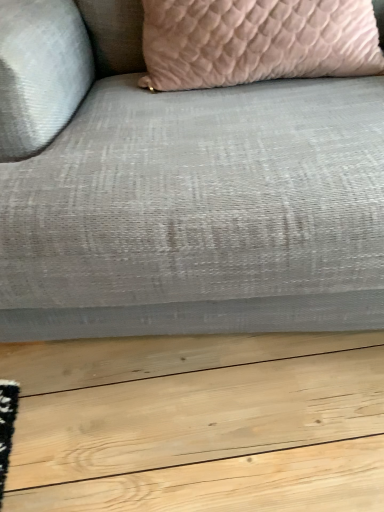
In order to face pink textured pillow at upper center, should I rotate leftwards or rightwards?

Rotate your view right by about 8.727°.

Describe the element at coordinates (256, 41) in the screenshot. This screenshot has height=512, width=384. I see `pink textured pillow at upper center` at that location.

You are a GUI agent. You are given a task and a screenshot of the screen. Output one action in this format:
    pyautogui.click(x=<x>, y=<y>)
    Task: Click on the pink textured pillow at upper center
    Image resolution: width=384 pixels, height=512 pixels.
    Given the screenshot: What is the action you would take?
    point(256,41)

Locate an element on the screen. The height and width of the screenshot is (512, 384). textured gray fabric couch at center is located at coordinates (199, 213).

Image resolution: width=384 pixels, height=512 pixels. What do you see at coordinates (199, 213) in the screenshot? I see `textured gray fabric couch at center` at bounding box center [199, 213].

Locate an element on the screen. Image resolution: width=384 pixels, height=512 pixels. pink textured pillow at upper center is located at coordinates (256, 41).

Between textured gray fabric couch at center and pink textured pillow at upper center, which one appears on the right side from the viewer's perspective?

From the viewer's perspective, pink textured pillow at upper center appears more on the right side.

Which object is further away from the camera, textured gray fabric couch at center or pink textured pillow at upper center?

pink textured pillow at upper center is more distant.

Does point (379, 271) lie in front of point (212, 64)?

That is True.

From the image's perspective, is textured gray fabric couch at center on top of pink textured pillow at upper center?

No.

From a real-world perspective, relative to pink textured pillow at upper center, is textured gray fabric couch at center vertically above or below?

Clearly, from a real-world perspective, textured gray fabric couch at center is below pink textured pillow at upper center.

Is textured gray fabric couch at center wider or thinner than pink textured pillow at upper center?

Considering their sizes, textured gray fabric couch at center looks broader than pink textured pillow at upper center.

In terms of height, does textured gray fabric couch at center look taller or shorter compared to pink textured pillow at upper center?

In the image, textured gray fabric couch at center appears to be taller than pink textured pillow at upper center.

Does textured gray fabric couch at center have a larger size compared to pink textured pillow at upper center?

Correct, textured gray fabric couch at center is larger in size than pink textured pillow at upper center.

Is textured gray fabric couch at center located outside pink textured pillow at upper center?

textured gray fabric couch at center lies outside pink textured pillow at upper center's area.

Is there a large distance between textured gray fabric couch at center and pink textured pillow at upper center?

That's not correct — textured gray fabric couch at center is a little close to pink textured pillow at upper center.

Is textured gray fabric couch at center oriented towards pink textured pillow at upper center?

Yes, textured gray fabric couch at center is aimed at pink textured pillow at upper center.

Measure the distance from textured gray fabric couch at center to pink textured pillow at upper center.

A distance of 12.29 inches exists between textured gray fabric couch at center and pink textured pillow at upper center.

Identify the location of pillow lying above the textured gray fabric couch at center (from the image's perspective). Image resolution: width=384 pixels, height=512 pixels. (256, 41).

Considering the positions of objects pink textured pillow at upper center and textured gray fabric couch at center in the image provided, who is more to the left, pink textured pillow at upper center or textured gray fabric couch at center?

Positioned to the left is textured gray fabric couch at center.

Relative to textured gray fabric couch at center, is pink textured pillow at upper center in front or behind?

pink textured pillow at upper center is positioned farther from the viewer than textured gray fabric couch at center.

Does point (195, 86) come behind point (188, 321)?

Yes, it is behind point (188, 321).

Based on the photo, from the image's perspective, does pink textured pillow at upper center appear higher than textured gray fabric couch at center?

Yes, from the image's perspective, pink textured pillow at upper center is above textured gray fabric couch at center.

From a real-world perspective, is pink textured pillow at upper center on textured gray fabric couch at center?

Yes.

Which of these two, pink textured pillow at upper center or textured gray fabric couch at center, is thinner?

pink textured pillow at upper center.

Considering the relative sizes of pink textured pillow at upper center and textured gray fabric couch at center in the image provided, is pink textured pillow at upper center taller than textured gray fabric couch at center?

No.

From the picture: Based on their sizes in the image, would you say pink textured pillow at upper center is bigger or smaller than textured gray fabric couch at center?

Clearly, pink textured pillow at upper center is smaller in size than textured gray fabric couch at center.

Would you say pink textured pillow at upper center is outside textured gray fabric couch at center?

No.

Are pink textured pillow at upper center and textured gray fabric couch at center making contact?

There is a gap between pink textured pillow at upper center and textured gray fabric couch at center.

Is pink textured pillow at upper center aimed at textured gray fabric couch at center?

Yes, pink textured pillow at upper center is aimed at textured gray fabric couch at center.

Identify the location of pillow above the textured gray fabric couch at center (from the image's perspective). (256, 41).

Find the location of a particular element. The image size is (384, 512). studio couch on the left of pink textured pillow at upper center is located at coordinates (199, 213).

Where is `pillow on the right of textured gray fabric couch at center`? This screenshot has height=512, width=384. pillow on the right of textured gray fabric couch at center is located at coordinates (256, 41).